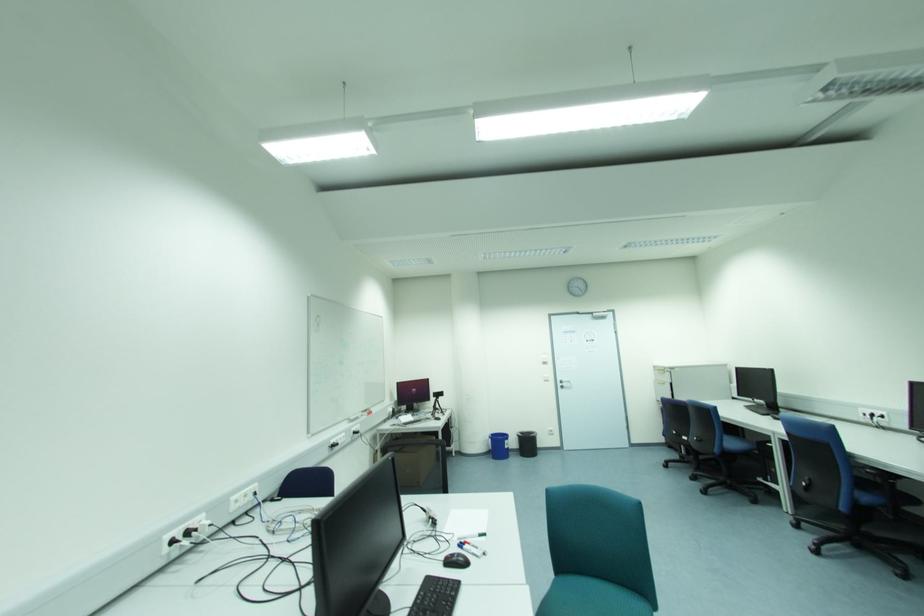
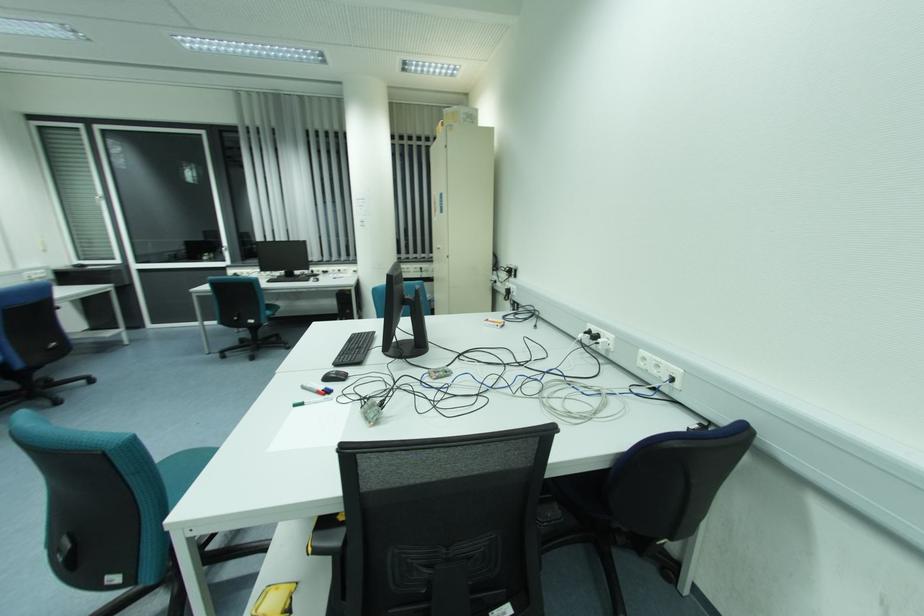
Find the pixel in the second image that matches point (174, 541) in the first image.

(590, 333)